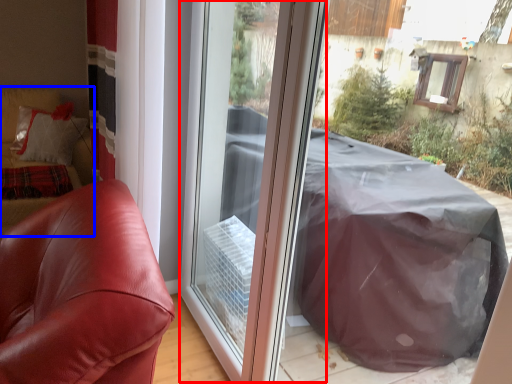
Question: Among these objects, which one is nearest to the camera, screen door (highlighted by a red box) or couch (highlighted by a blue box)?

Choices:
 (A) screen door
 (B) couch

Answer: (A)